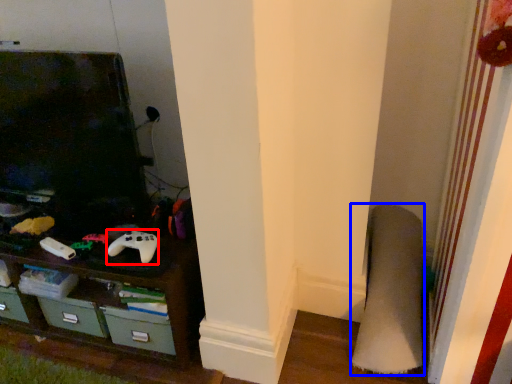
Question: Which point is further to the camera, game controller (highlighted by a red box) or plain (highlighted by a blue box)?

Choices:
 (A) game controller
 (B) plain

Answer: (A)